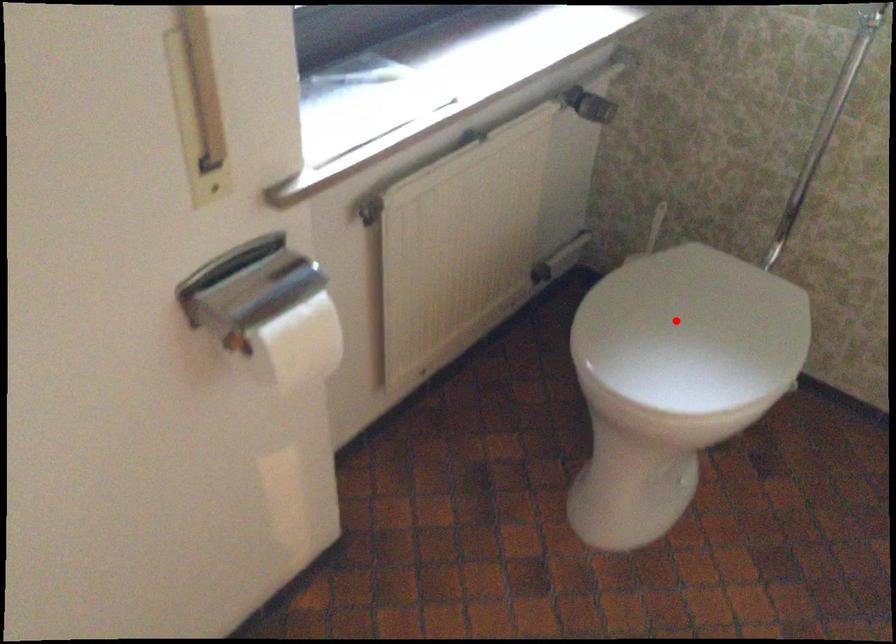
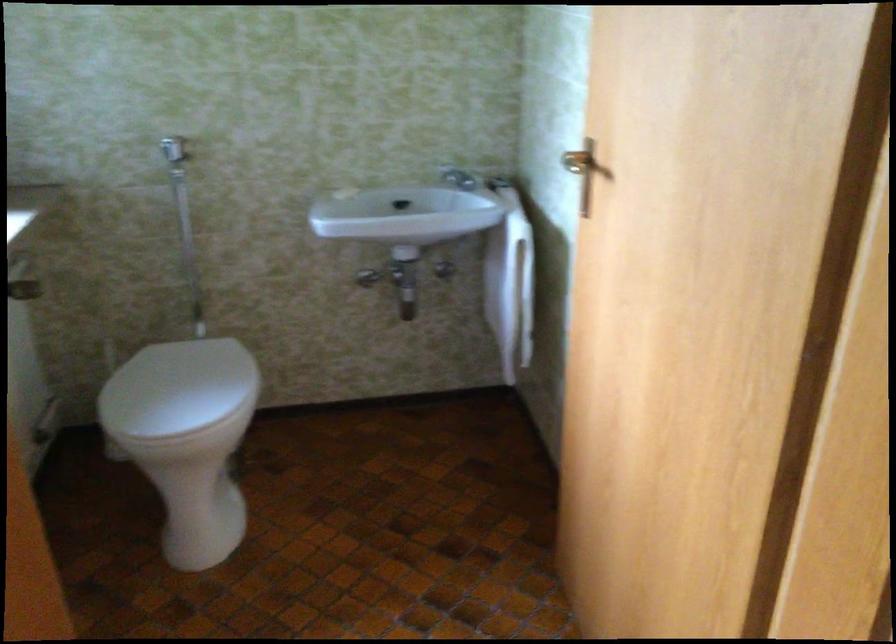
Locate, in the second image, the point that corresponds to the highlighted location in the first image.

(177, 388)